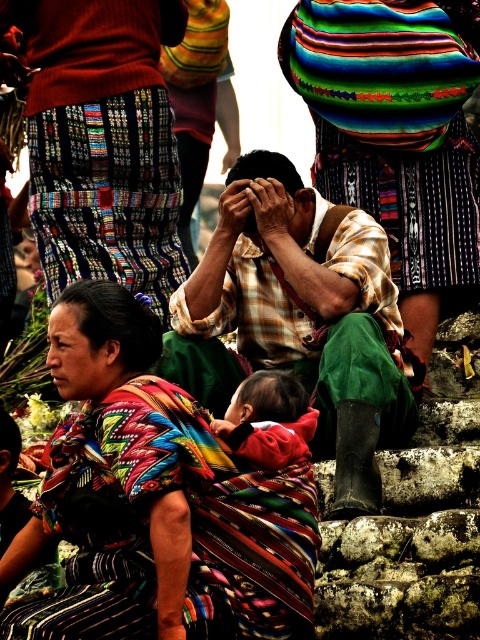
You are a photographer trying to capture a closeup of the red fabric baby at center and the matte black forehead at center. Since you can only focus on one subject, which one is positioned to the right side of the frame?

The red fabric baby at center is to the right of the matte black forehead at center, so the photographer should focus on the red fabric baby at center to capture the right side subject.